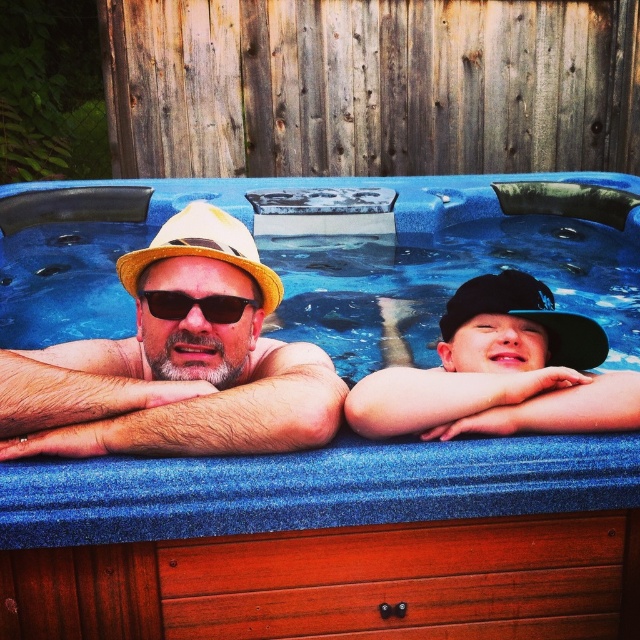
You are designing a safety railing for the hot tub area. Considering the blue textured hot tub at center and the sunglasses at center, which object is taller and requires more consideration for visibility and safety?

The blue textured hot tub at center is taller than the sunglasses at center, so it requires more consideration for visibility and safety.